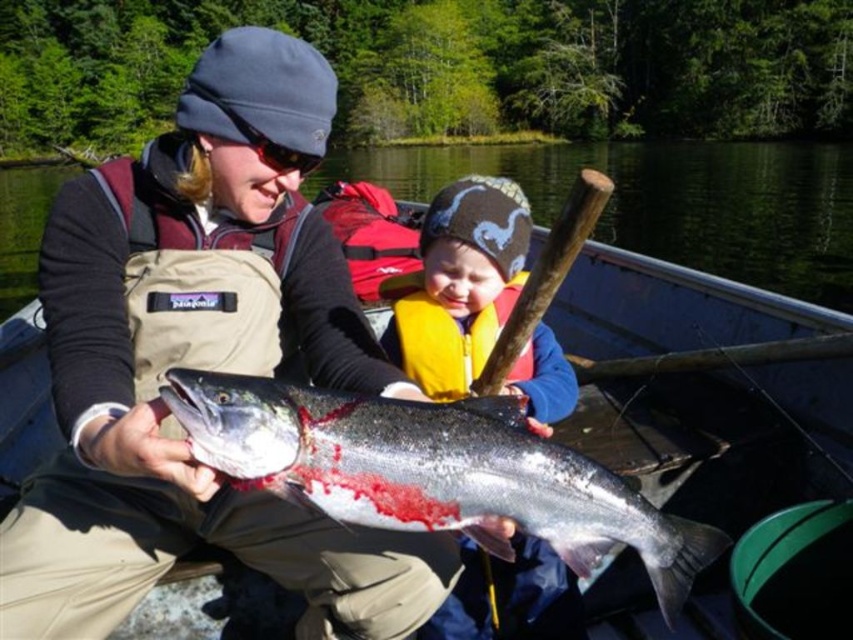
Question: Observing the image, what is the correct spatial positioning of shiny silver fish at center in reference to yellow life jacket at center?

Choices:
 (A) above
 (B) below

Answer: (B)

Question: Does matte blue jacket at center appear on the left side of yellow life jacket at center?

Choices:
 (A) yes
 (B) no

Answer: (A)

Question: Is the position of shiny silver fish at center less distant than that of matte blue jacket at center?

Choices:
 (A) yes
 (B) no

Answer: (A)

Question: Among these objects, which one is farthest from the camera?

Choices:
 (A) yellow life jacket at center
 (B) matte blue jacket at center
 (C) shiny silver fish at center

Answer: (A)

Question: Which of these objects is positioned closest to the blue plastic boat at center?

Choices:
 (A) yellow life jacket at center
 (B) shiny silver fish at center
 (C) matte blue jacket at center

Answer: (C)

Question: Based on their relative distances, which object is farther from the matte blue jacket at center?

Choices:
 (A) shiny silver fish at center
 (B) blue plastic boat at center

Answer: (B)